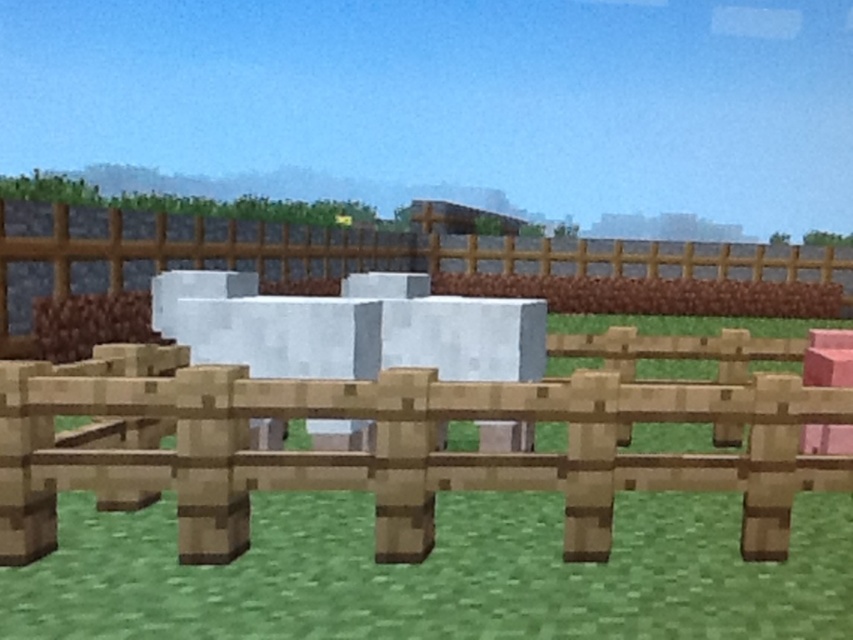
Consider the image. You are navigating through a Minecraft scene and want to place a new block. You have two points marked as point coordinates in the scene. Which point is closer to you, point (641,500) or point (532,241)?

Point (641,500) is closer to the camera than point (532,241), so it is the closer point to you.

You are a character in Minecraft trying to build a garden. You see the green grass at center and the wooden fence at center. Which area is more suitable for planting crops?

The green grass at center is more suitable for planting crops because it is smaller than the wooden fence at center, making it easier to till the soil and plant seeds directly on the grass.

You are playing Minecraft and need to place a new block between the green grass at center and the wooden fence at center. Based on their positions, where should you place the block?

Since the green grass at center is to the left of the wooden fence at center, you should place the new block between them on the right side of the green grass at center and the left side of the wooden fence at center.